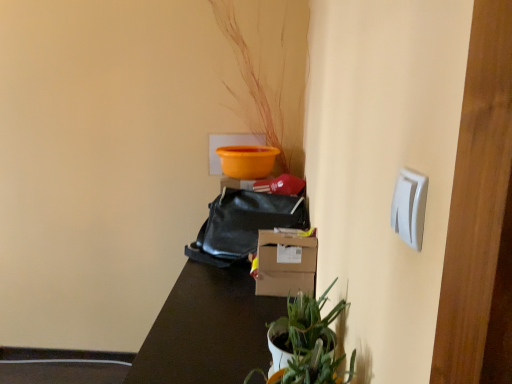
At what (x,y) coordinates should I click in order to perform the action: click on blank space situated above brown matte table at center (from a real-world perspective). Please return your answer as a coordinate pair (x, y). Looking at the image, I should click on (221, 303).